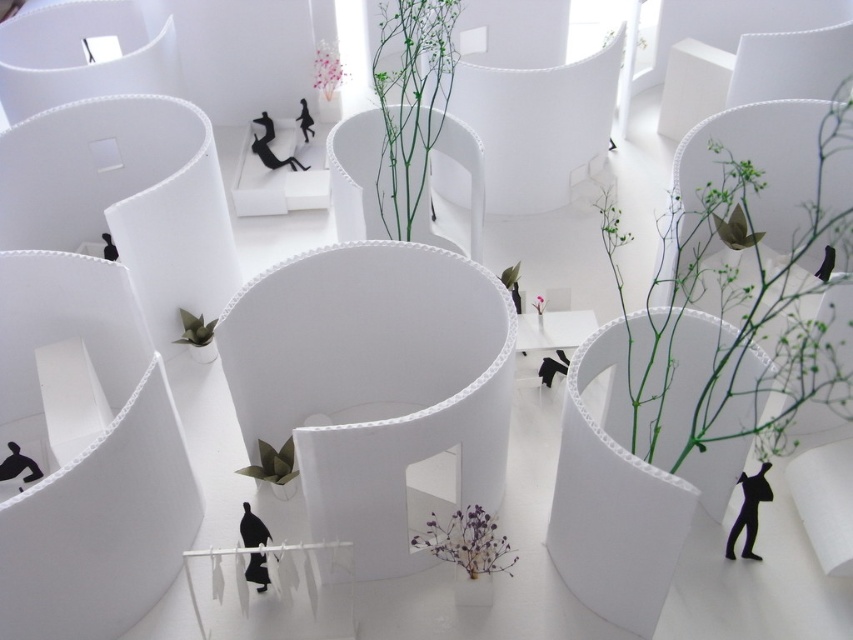
Does black matte figure at lower right have a greater width compared to pink floral arrangement at upper center?

Incorrect, black matte figure at lower right's width does not surpass pink floral arrangement at upper center's.

Is black matte figure at lower right smaller than pink floral arrangement at upper center?

Correct, black matte figure at lower right occupies less space than pink floral arrangement at upper center.

Is point (755, 516) behind point (321, 81)?

No.

Where is `black matte figure at lower right`? black matte figure at lower right is located at coordinates (747, 512).

Between point (430, 548) and point (537, 301), which one is positioned in front?

Point (430, 548) is more forward.

Measure the distance from purple dried flowers at center to pink matte flower at center.

5.76 feet

The width and height of the screenshot is (853, 640). I want to click on purple dried flowers at center, so click(x=467, y=541).

Between black matte figure at lower right and green matte paper flower at center, which one is positioned higher?

green matte paper flower at center

Between black matte figure at lower right and green matte paper flower at center, which one has more height?

black matte figure at lower right

This screenshot has height=640, width=853. I want to click on black matte figure at lower right, so click(x=747, y=512).